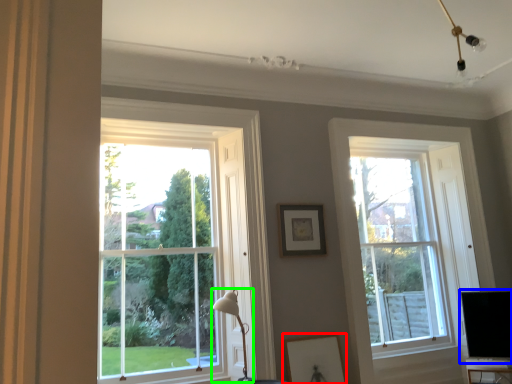
Question: Which object is the closest to the picture frame (highlighted by a red box)? Choose among these: computer monitor (highlighted by a blue box) or table lamp (highlighted by a green box).

Choices:
 (A) computer monitor
 (B) table lamp

Answer: (B)